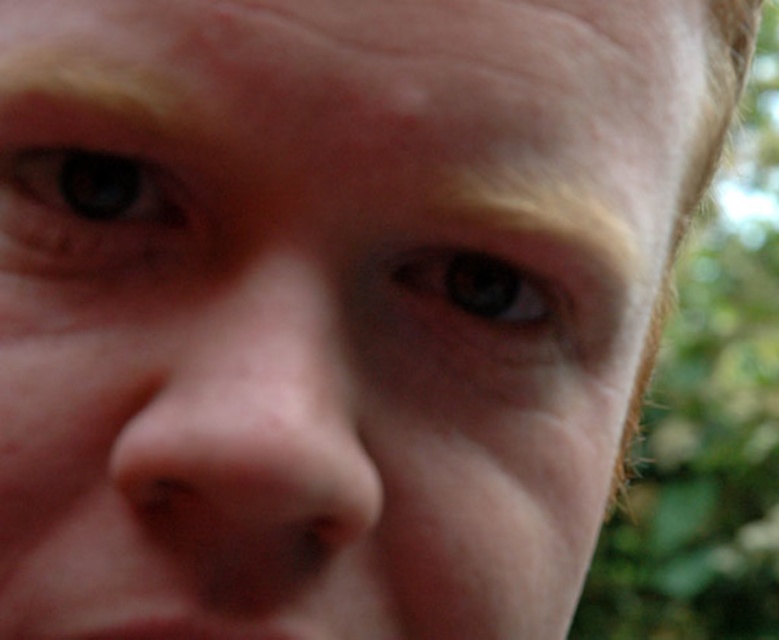
Between smooth skin nose at center and brown matte eye at center, which one is positioned higher?

brown matte eye at center is above.

Between point (302, 419) and point (399, 260), which one is positioned in front?

Positioned in front is point (302, 419).

At what (x,y) coordinates should I click in order to perform the action: click on smooth skin nose at center. Please return your answer as a coordinate pair (x, y). This screenshot has height=640, width=779. Looking at the image, I should click on (252, 429).

Who is higher up, smooth skin nose at center or blue matte eye at upper left?

blue matte eye at upper left is higher up.

The height and width of the screenshot is (640, 779). What are the coordinates of `smooth skin nose at center` in the screenshot? It's located at (252, 429).

Does point (145, 230) come closer to viewer compared to point (513, 323)?

Yes, point (145, 230) is in front of point (513, 323).

Is blue matte eye at upper left behind brown matte eye at center?

No, blue matte eye at upper left is in front of brown matte eye at center.

Is point (30, 225) positioned behind point (534, 282)?

No, it is not.

You are a GUI agent. You are given a task and a screenshot of the screen. Output one action in this format:
    pyautogui.click(x=<x>, y=<y>)
    Task: Click on the blue matte eye at upper left
    The width and height of the screenshot is (779, 640).
    Given the screenshot: What is the action you would take?
    pyautogui.click(x=93, y=202)